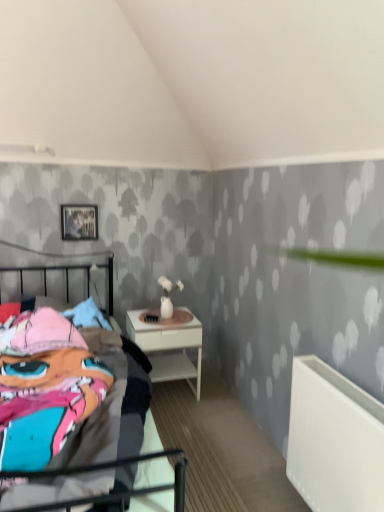
Identify the location of metallic silver picture frame at upper left. The image size is (384, 512). (79, 222).

This screenshot has width=384, height=512. In order to click on multicolored fabric bed at left in this screenshot , I will do `click(113, 416)`.

At what (x,y) coordinates should I click in order to perform the action: click on white glossy nightstand at center. Please return your answer as a coordinate pair (x, y). Looking at the image, I should click on pyautogui.click(x=169, y=345).

What is the approximate width of white plastic radiator at lower right?

The width of white plastic radiator at lower right is 4.43 inches.

The width and height of the screenshot is (384, 512). I want to click on metallic silver picture frame at upper left, so click(79, 222).

Is metallic silver picture frame at upper left thinner than white plastic radiator at lower right?

Indeed, metallic silver picture frame at upper left has a lesser width compared to white plastic radiator at lower right.

Can we say metallic silver picture frame at upper left lies outside white plastic radiator at lower right?

Yes, metallic silver picture frame at upper left is outside of white plastic radiator at lower right.

Is metallic silver picture frame at upper left positioned before white plastic radiator at lower right?

No.

Which of these two, white glossy nightstand at center or white plastic radiator at lower right, stands shorter?

Standing shorter between the two is white glossy nightstand at center.

The width and height of the screenshot is (384, 512). In order to click on nightstand located above the white plastic radiator at lower right (from the image's perspective) in this screenshot , I will do `click(169, 345)`.

Is white glossy nightstand at center further to the viewer compared to white plastic radiator at lower right?

Yes, the depth of white glossy nightstand at center is greater than that of white plastic radiator at lower right.

Is white glossy nightstand at center not near white plastic radiator at lower right?

That's right, there is a large distance between white glossy nightstand at center and white plastic radiator at lower right.

Is metallic silver picture frame at upper left completely or partially outside of multicolored fabric bed at left?

Yes, metallic silver picture frame at upper left is not within multicolored fabric bed at left.

How many degrees apart are the facing directions of metallic silver picture frame at upper left and multicolored fabric bed at left?

0.305 degrees separate the facing orientations of metallic silver picture frame at upper left and multicolored fabric bed at left.

From a real-world perspective, is metallic silver picture frame at upper left located beneath multicolored fabric bed at left?

No, from a real-world perspective, metallic silver picture frame at upper left is not beneath multicolored fabric bed at left.

Based on their positions, is metallic silver picture frame at upper left located to the left or right of multicolored fabric bed at left?

From the image, it's evident that metallic silver picture frame at upper left is to the left of multicolored fabric bed at left.

How different are the orientations of metallic silver picture frame at upper left and white glossy nightstand at center in degrees?

The angle between the facing direction of metallic silver picture frame at upper left and the facing direction of white glossy nightstand at center is 0.855 degrees.

Between metallic silver picture frame at upper left and white glossy nightstand at center, which one has less height?

Standing shorter between the two is metallic silver picture frame at upper left.

Does metallic silver picture frame at upper left have a greater width compared to white glossy nightstand at center?

No, metallic silver picture frame at upper left is not wider than white glossy nightstand at center.

Which object is more forward, metallic silver picture frame at upper left or white glossy nightstand at center?

white glossy nightstand at center is in front.

Could multicolored fabric bed at left be considered to be inside white glossy nightstand at center?

No, multicolored fabric bed at left is not surrounded by white glossy nightstand at center.

Identify the location of bed in front of the white glossy nightstand at center. (113, 416).

From a real-world perspective, is white glossy nightstand at center physically below multicolored fabric bed at left?

Yes, from a real-world perspective, white glossy nightstand at center is under multicolored fabric bed at left.

From the image's perspective, is white glossy nightstand at center on top of multicolored fabric bed at left?

Actually, white glossy nightstand at center appears below multicolored fabric bed at left in the image.

I want to click on picture frame behind the white glossy nightstand at center, so click(x=79, y=222).

Is white glossy nightstand at center shorter than metallic silver picture frame at upper left?

Incorrect, the height of white glossy nightstand at center does not fall short of that of metallic silver picture frame at upper left.

How much distance is there between white glossy nightstand at center and metallic silver picture frame at upper left?

white glossy nightstand at center is 36.75 inches away from metallic silver picture frame at upper left.

Is white glossy nightstand at center situated inside metallic silver picture frame at upper left or outside?

The correct answer is: outside.

Are multicolored fabric bed at left and white glossy nightstand at center located far from each other?

No, there isn't a large distance between multicolored fabric bed at left and white glossy nightstand at center.

Can you tell me how much multicolored fabric bed at left and white glossy nightstand at center differ in facing direction?

0.549 degrees separate the facing orientations of multicolored fabric bed at left and white glossy nightstand at center.

Considering the positions of objects multicolored fabric bed at left and white glossy nightstand at center in the image provided, who is behind, multicolored fabric bed at left or white glossy nightstand at center?

white glossy nightstand at center is more distant.

Looking at this image, is multicolored fabric bed at left inside or outside of white glossy nightstand at center?

multicolored fabric bed at left cannot be found inside white glossy nightstand at center.

At what (x,y) coordinates should I click in order to perform the action: click on picture frame on the left of white plastic radiator at lower right. Please return your answer as a coordinate pair (x, y). Looking at the image, I should click on (79, 222).

Find the location of a particular element. radiator located below the white glossy nightstand at center (from the image's perspective) is located at coordinates (334, 440).

When comparing their distances from metallic silver picture frame at upper left, does white glossy nightstand at center or multicolored fabric bed at left seem further?

multicolored fabric bed at left lies further to metallic silver picture frame at upper left than the other object.

Considering their positions, is multicolored fabric bed at left positioned closer to white plastic radiator at lower right than metallic silver picture frame at upper left?

Among the two, multicolored fabric bed at left is located nearer to white plastic radiator at lower right.

Based on their spatial positions, is white glossy nightstand at center or white plastic radiator at lower right closer to metallic silver picture frame at upper left?

white glossy nightstand at center is positioned closer to the anchor metallic silver picture frame at upper left.

Based on their spatial positions, is metallic silver picture frame at upper left or white plastic radiator at lower right further from white glossy nightstand at center?

white plastic radiator at lower right is further to white glossy nightstand at center.

When comparing their distances from metallic silver picture frame at upper left, does white plastic radiator at lower right or white glossy nightstand at center seem further?

Based on the image, white plastic radiator at lower right appears to be further to metallic silver picture frame at upper left.

In the scene shown: Estimate the real-world distances between objects in this image. Which object is closer to multicolored fabric bed at left, white glossy nightstand at center or white plastic radiator at lower right?

white glossy nightstand at center lies closer to multicolored fabric bed at left than the other object.

Estimate the real-world distances between objects in this image. Which object is closer to white plastic radiator at lower right, metallic silver picture frame at upper left or white glossy nightstand at center?

Based on the image, white glossy nightstand at center appears to be nearer to white plastic radiator at lower right.

Estimate the real-world distances between objects in this image. Which object is further from multicolored fabric bed at left, white glossy nightstand at center or metallic silver picture frame at upper left?

metallic silver picture frame at upper left is positioned further to the anchor multicolored fabric bed at left.

You are a GUI agent. You are given a task and a screenshot of the screen. Output one action in this format:
    pyautogui.click(x=<x>, y=<y>)
    Task: Click on the radiator positioned between multicolored fabric bed at left and white glossy nightstand at center from near to far
    The width and height of the screenshot is (384, 512).
    Given the screenshot: What is the action you would take?
    pyautogui.click(x=334, y=440)

The width and height of the screenshot is (384, 512). Identify the location of nightstand positioned between white plastic radiator at lower right and metallic silver picture frame at upper left from near to far. (169, 345).

Image resolution: width=384 pixels, height=512 pixels. In order to click on radiator positioned between multicolored fabric bed at left and metallic silver picture frame at upper left from near to far in this screenshot , I will do `click(334, 440)`.

Locate an element on the screen. The image size is (384, 512). nightstand positioned between multicolored fabric bed at left and metallic silver picture frame at upper left from near to far is located at coordinates (169, 345).